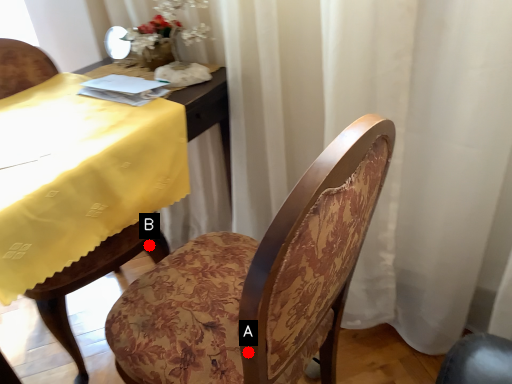
Question: Two points are circled on the image, labeled by A and B beside each circle. Which point is further to the camera?

Choices:
 (A) A is further
 (B) B is further

Answer: (B)